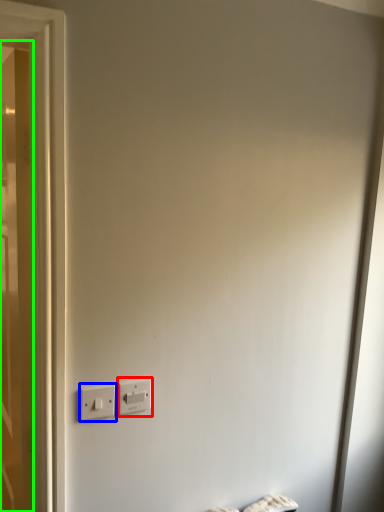
Question: Based on their relative distances, which object is farther from power plugs and sockets (highlighted by a red box)? Choose from power plugs and sockets (highlighted by a blue box) and door (highlighted by a green box).

Choices:
 (A) power plugs and sockets
 (B) door

Answer: (B)